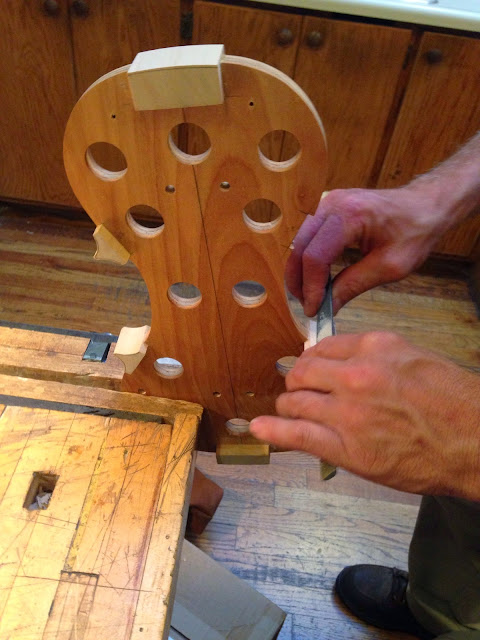
At what (x,y) coordinates should I click in order to perform the action: click on cupboard. Please return your answer as a coordinate pair (x, y). This screenshot has height=640, width=480. Looking at the image, I should click on (334, 73), (42, 68), (425, 90).